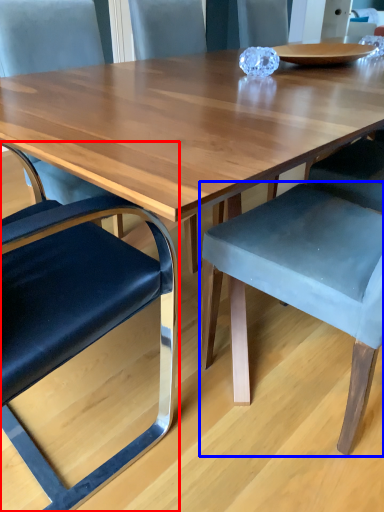
Question: Which point is closer to the camera, chair (highlighted by a red box) or chair (highlighted by a blue box)?

Choices:
 (A) chair
 (B) chair

Answer: (A)